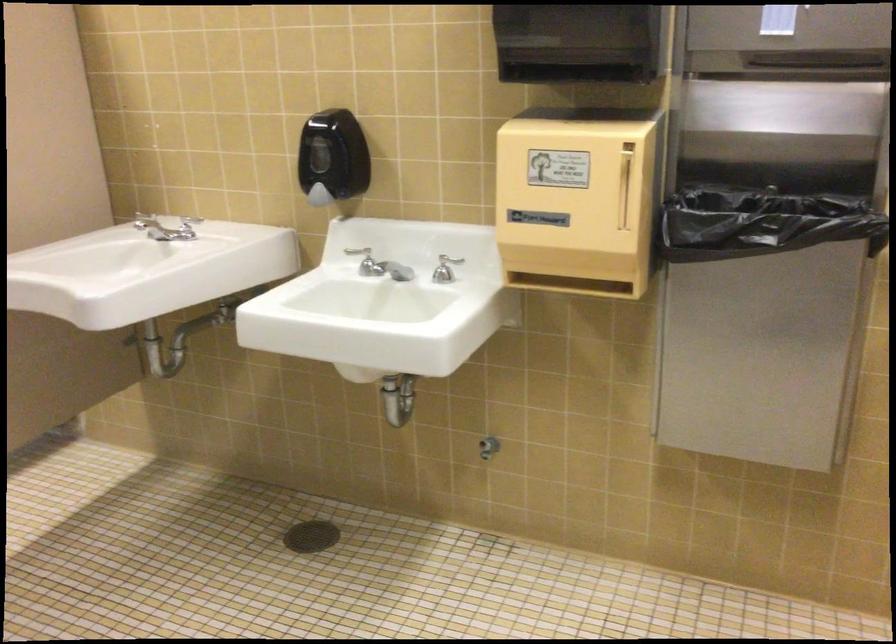
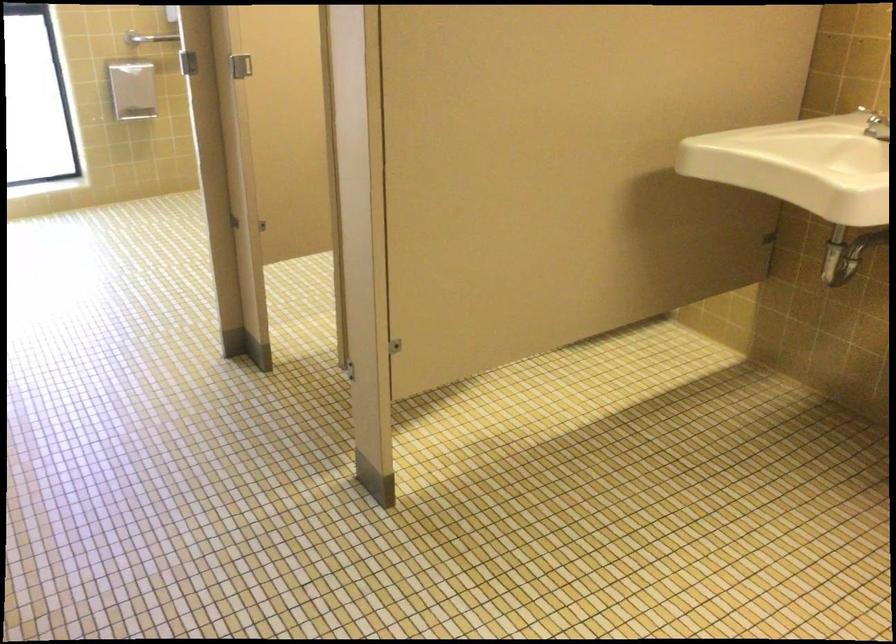
Question: How did the camera likely rotate?

Choices:
 (A) Left
 (B) Right
 (C) Up
 (D) Down

Answer: (A)